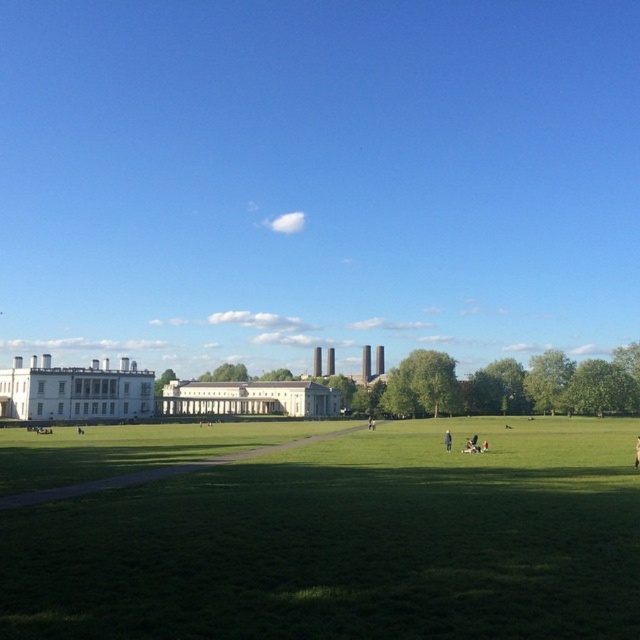
Question: Which point appears closest to the camera in this image?

Choices:
 (A) (612, 595)
 (B) (634, 460)
 (C) (355, 108)

Answer: (A)

Question: Is blue sky at upper center further to the viewer compared to brown leather jacket at center?

Choices:
 (A) yes
 (B) no

Answer: (A)

Question: Which point appears farthest from the camera in this image?

Choices:
 (A) (292, 332)
 (B) (445, 444)

Answer: (A)

Question: Is green grass at center to the right of brown leather jacket at center from the viewer's perspective?

Choices:
 (A) no
 (B) yes

Answer: (A)

Question: Which point is closer to the camera?

Choices:
 (A) dark blue fabric at center
 (B) brown leather jacket at center
 (C) green grass at center
 (D) blue sky at upper center

Answer: (C)

Question: In this image, where is blue sky at upper center located relative to dark blue fabric at center?

Choices:
 (A) below
 (B) above

Answer: (B)